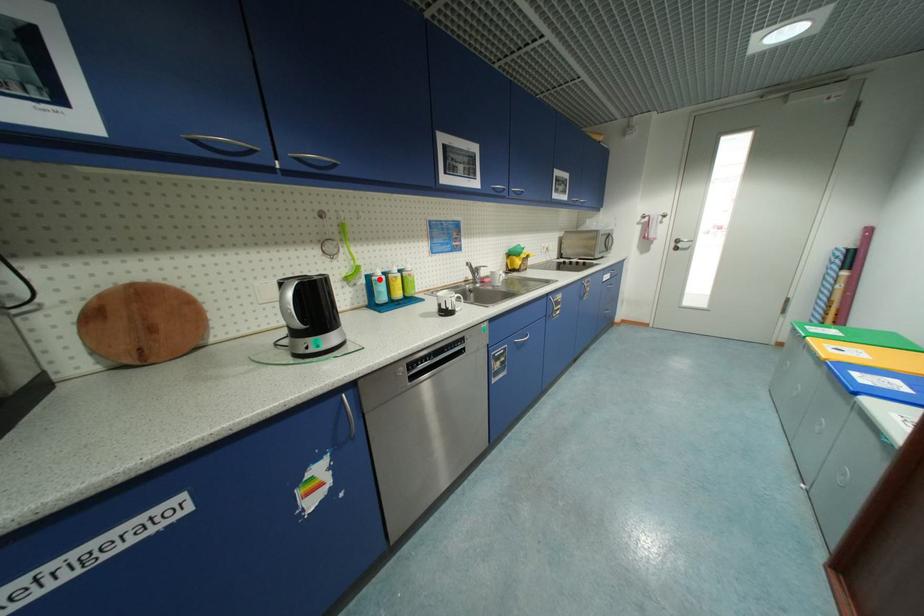
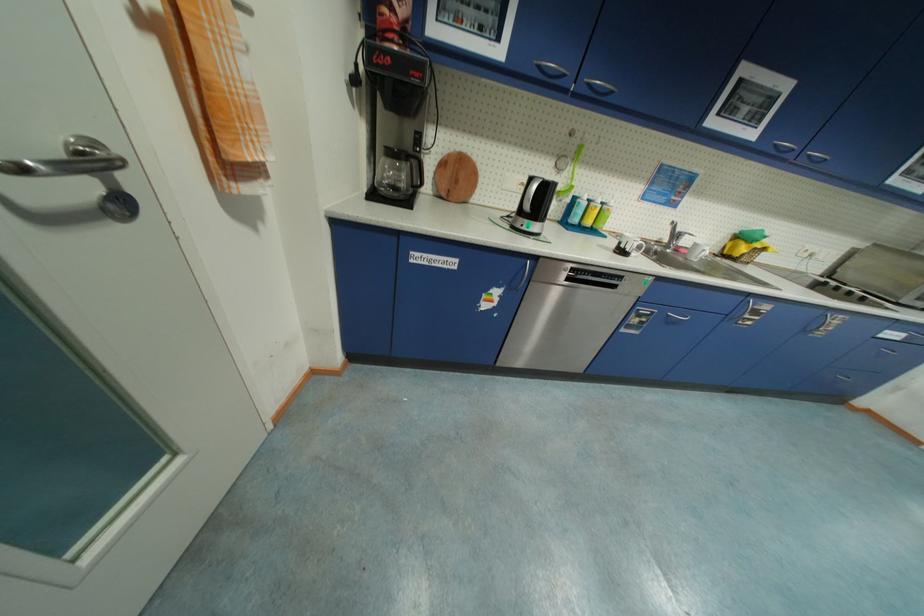
Find the pixel in the second image that matches the highlighted location in the first image.

(584, 201)